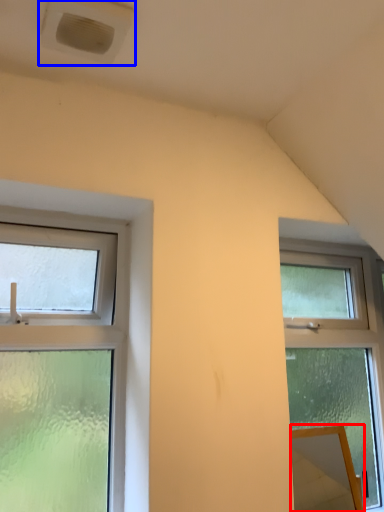
Question: Which object is further to the camera taking this photo, mirror (highlighted by a red box) or air conditioning (highlighted by a blue box)?

Choices:
 (A) mirror
 (B) air conditioning

Answer: (A)